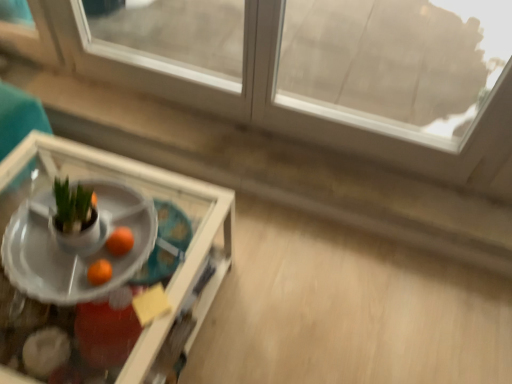
Where is `vacant area that is in front of orange matte at center`? This screenshot has width=512, height=384. vacant area that is in front of orange matte at center is located at coordinates (102, 292).